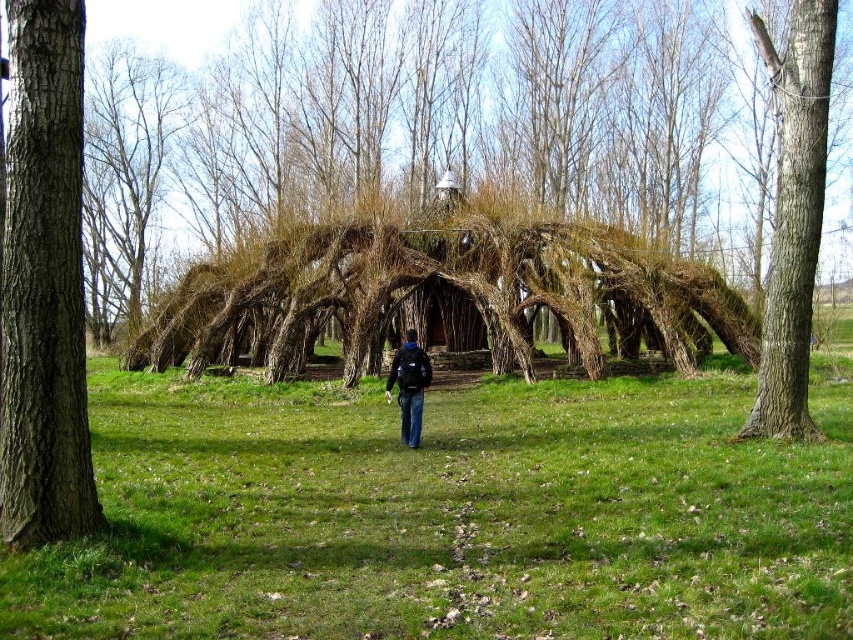
Question: Based on their relative distances, which object is farther from the smooth brown bark at upper right?

Choices:
 (A) green grass at center
 (B) brown rough tree trunk at left

Answer: (B)

Question: Where is green grass at center located in relation to dark blue jeans at center in the image?

Choices:
 (A) below
 (B) above

Answer: (A)

Question: Can you confirm if green grass at center is smaller than dark blue jeans at center?

Choices:
 (A) no
 (B) yes

Answer: (A)

Question: Among these objects, which one is farthest from the camera?

Choices:
 (A) dark blue jeans at center
 (B) green grass at center

Answer: (A)

Question: Is brown rough tree trunk at left further to camera compared to smooth brown bark at upper right?

Choices:
 (A) no
 (B) yes

Answer: (A)

Question: Which point is closer to the camera taking this photo?

Choices:
 (A) (393, 550)
 (B) (389, 387)
 (C) (64, 362)

Answer: (C)